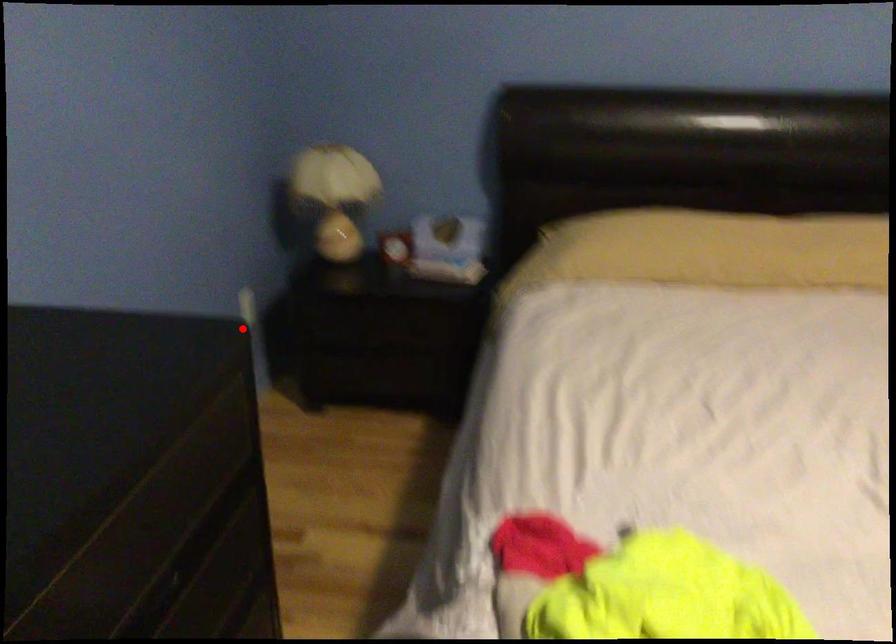
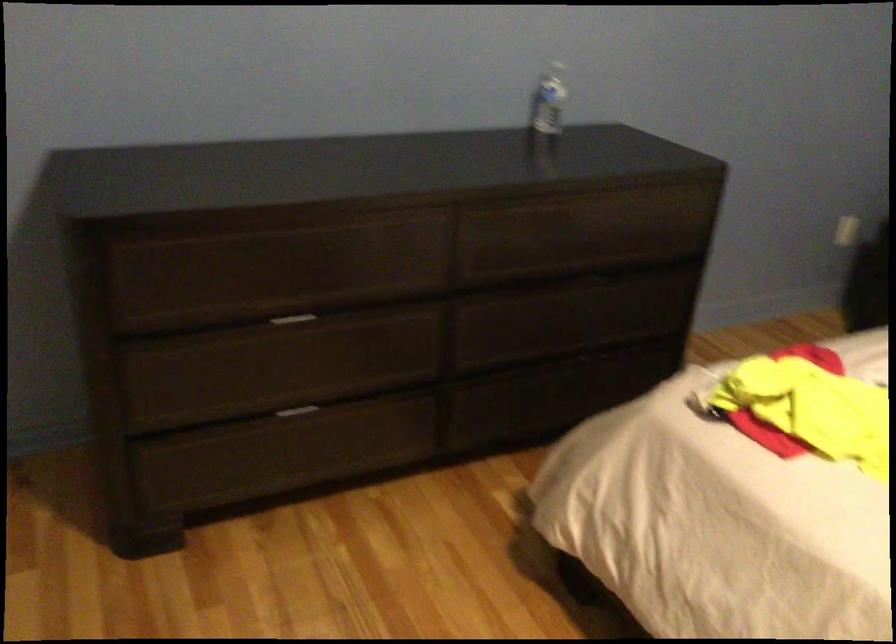
Question: I am providing you with two images of the same scene from different viewpoints. A red point is marked on the first image. Can you still see the location of the red point in image 2?

Choices:
 (A) Yes
 (B) No

Answer: (A)